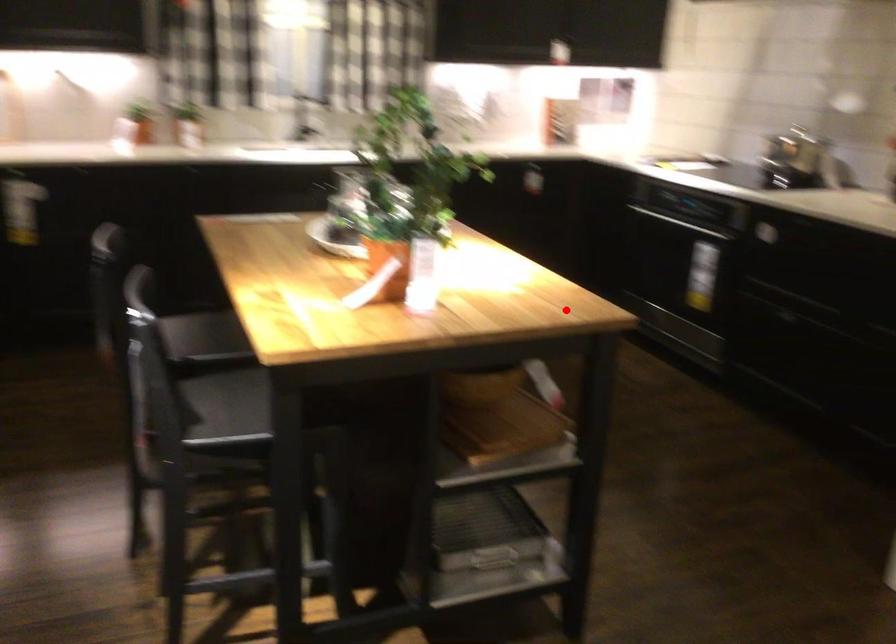
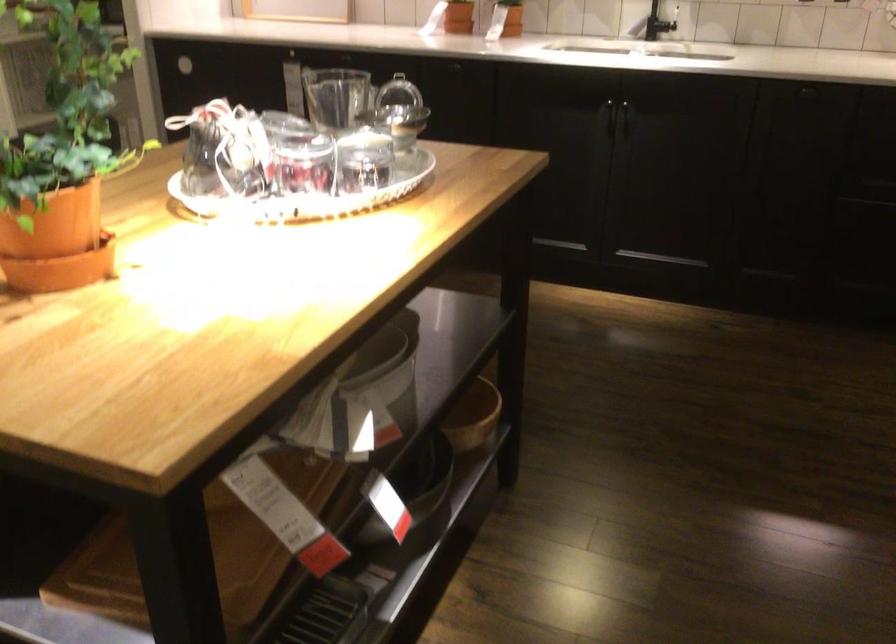
The point at the highlighted location is marked in the first image. Where is the corresponding point in the second image?

(135, 406)